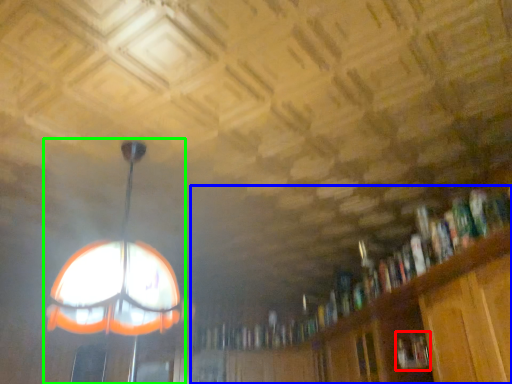
Question: Which object is the closest to the book (highlighted by a red box)? Choose among these: bookcase (highlighted by a blue box) or lamp (highlighted by a green box).

Choices:
 (A) bookcase
 (B) lamp

Answer: (A)